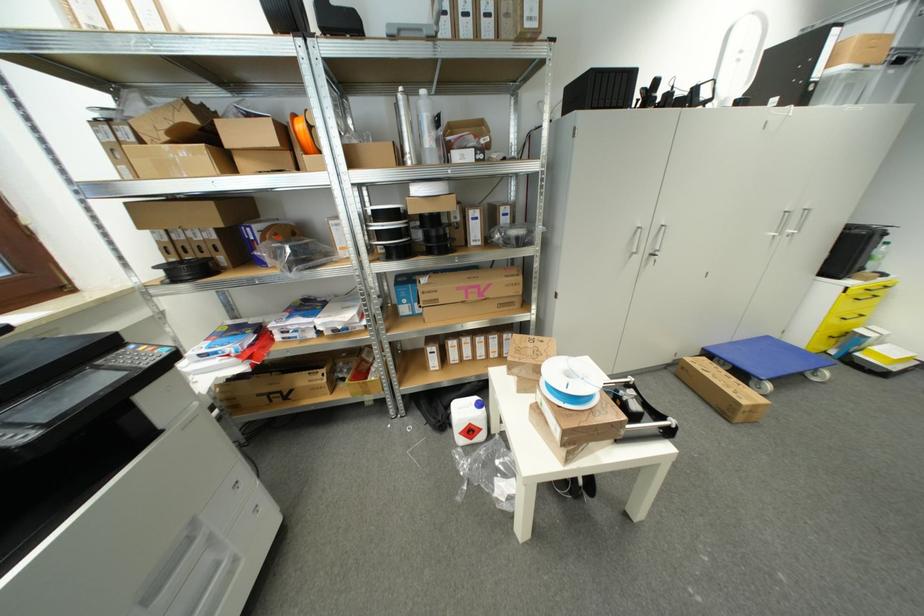
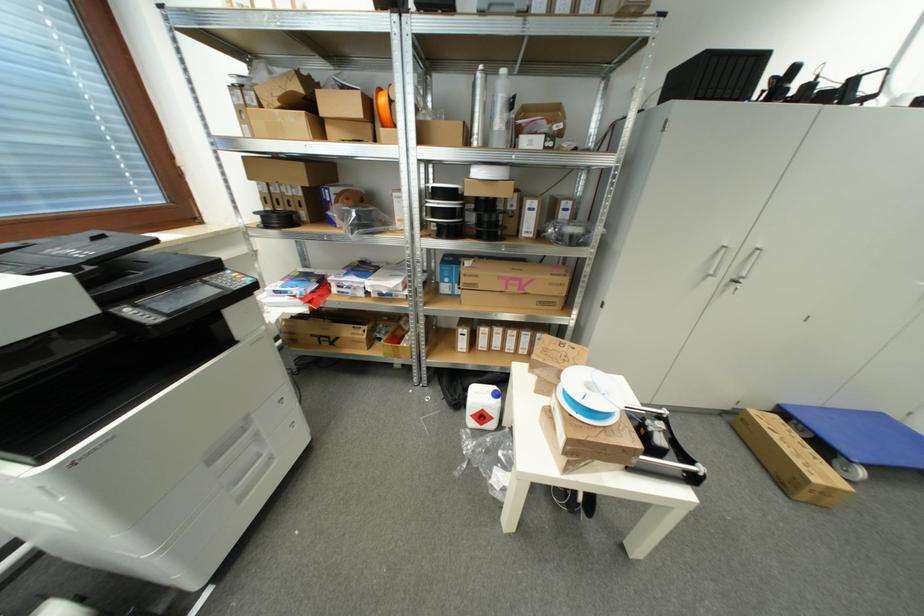
Locate, in the second image, the point that corresponds to point 709,361 in the first image.

(781, 419)